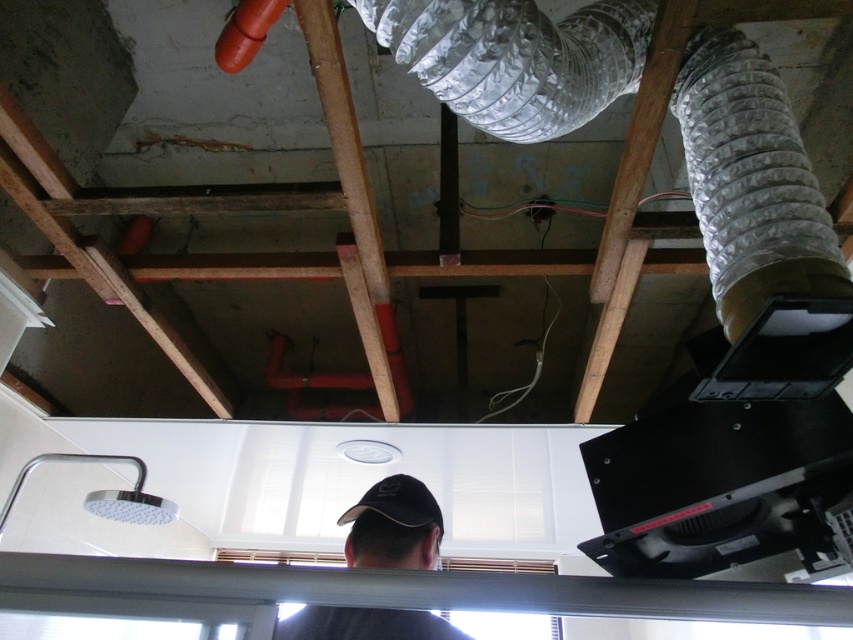
Can you confirm if white plastic beam at lower center is bigger than brown wooden beam at center?

No, white plastic beam at lower center is not bigger than brown wooden beam at center.

Is white plastic beam at lower center below brown wooden beam at center?

Correct, white plastic beam at lower center is located below brown wooden beam at center.

Is point (99, 568) positioned before point (393, 337)?

Yes, it is in front of point (393, 337).

In order to click on white plastic beam at lower center in this screenshot , I will do `click(431, 588)`.

Between point (485, 589) and point (387, 477), which one is positioned behind?

Positioned behind is point (387, 477).

Which of these two, white plastic beam at lower center or black fabric baseball cap at center, stands taller?

black fabric baseball cap at center is taller.

Does point (82, 568) come farther from viewer compared to point (439, 522)?

No.

The width and height of the screenshot is (853, 640). What are the coordinates of `white plastic beam at lower center` in the screenshot? It's located at (431, 588).

Is black cap at center in front of black fabric baseball cap at center?

Yes, black cap at center is closer to the viewer.

Which is more to the right, black cap at center or black fabric baseball cap at center?

Positioned to the right is black cap at center.

Where is `black cap at center`? black cap at center is located at coordinates (393, 525).

Find the location of a particular element. black cap at center is located at coordinates (393, 525).